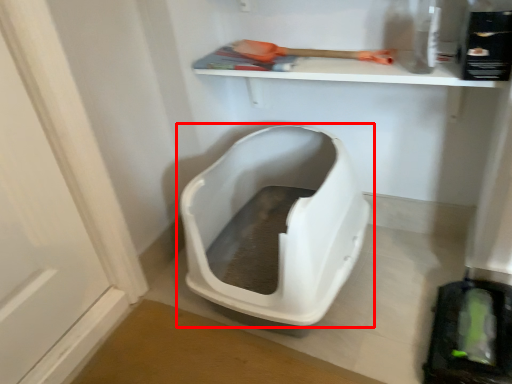
Question: In this image, where is toilet (annotated by the red box) located relative to tool?

Choices:
 (A) right
 (B) left

Answer: (B)